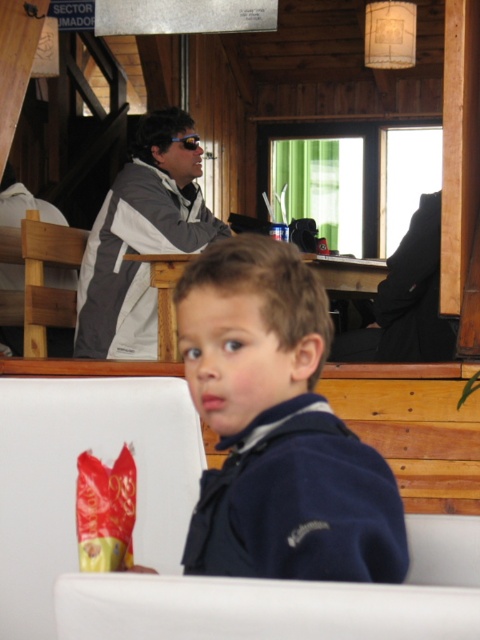
Between point (248, 348) and point (15, 276), which one is positioned behind?

Positioned behind is point (15, 276).

Which of these two, dark blue fleece at center or gray fabric jacket at upper left, stands shorter?

Standing shorter between the two is gray fabric jacket at upper left.

Which is behind, point (315, 563) or point (40, 200)?

Point (40, 200)

You are a GUI agent. You are given a task and a screenshot of the screen. Output one action in this format:
    pyautogui.click(x=<x>, y=<y>)
    Task: Click on the dark blue fleece at center
    Image resolution: width=480 pixels, height=640 pixels.
    Given the screenshot: What is the action you would take?
    pyautogui.click(x=278, y=426)

Who is positioned more to the right, wooden chair at left or blue reflective lens goggles at upper center?

From the viewer's perspective, blue reflective lens goggles at upper center appears more on the right side.

Can you confirm if wooden chair at left is wider than blue reflective lens goggles at upper center?

Yes.

Between point (66, 234) and point (197, 134), which one is positioned in front?

Point (66, 234) is in front.

Find the location of a particular element. This screenshot has height=640, width=480. wooden chair at left is located at coordinates (43, 278).

Which is below, wooden chair at center or blue reflective lens goggles at upper center?

wooden chair at center is lower down.

Where is `wooden chair at center`? Image resolution: width=480 pixels, height=640 pixels. wooden chair at center is located at coordinates (165, 296).